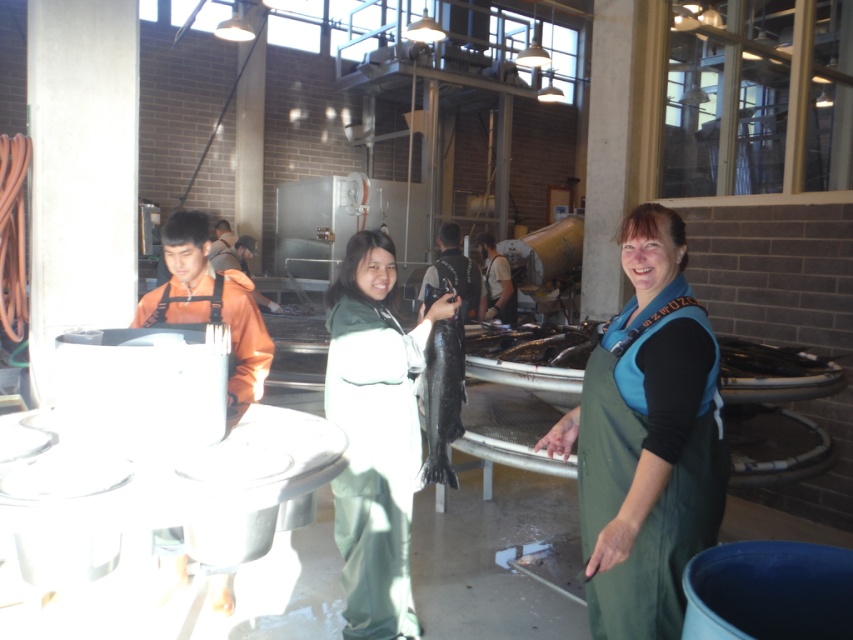
Is green matte uniform at center in front of black matte fish at center?

Yes.

Which of these two, green matte uniform at center or black matte fish at center, stands taller?

green matte uniform at center is taller.

Does point (367, 506) lie in front of point (453, 387)?

Yes, point (367, 506) is in front of point (453, 387).

Image resolution: width=853 pixels, height=640 pixels. I want to click on green matte uniform at center, so click(x=375, y=435).

Which is in front, point (712, 346) or point (552, 332)?

Positioned in front is point (712, 346).

Which of these two, green fabric apron at center or shiny black fish at center, stands taller?

green fabric apron at center

Is point (715, 348) farther from camera compared to point (502, 333)?

No, it is not.

Locate an element on the screen. Image resolution: width=853 pixels, height=640 pixels. green fabric apron at center is located at coordinates (646, 440).

Is green fabric apron at center above green matte uniform at center?

Yes.

Who is more forward, (x=605, y=625) or (x=358, y=276)?

Point (x=605, y=625) is in front.

The image size is (853, 640). I want to click on green fabric apron at center, so click(x=646, y=440).